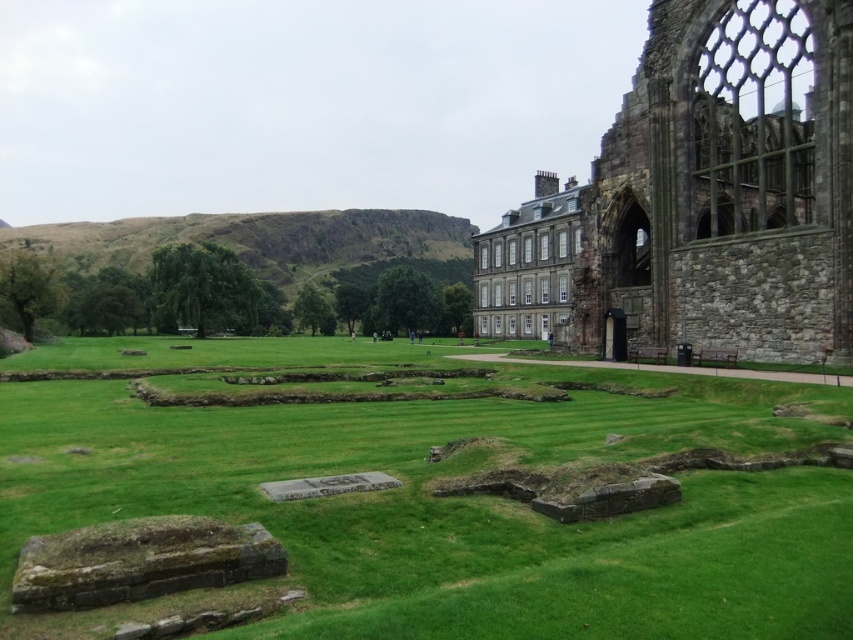
You are a visitor standing at the entrance of the historic stone structure. You notice the green grass at center and the stone wall at right. Which of these two features is positioned lower in the scene?

The green grass at center is located below the stone wall at right, so it is positioned lower in the scene.

You are standing at the entrance of the historic stone structure and want to walk towards the point labeled as point (683, 61). However, there is an obstacle at point (676, 435). Will you encounter this obstacle before reaching your destination?

Yes, you will encounter the obstacle at point (676, 435) before reaching point (683, 61) because point (676, 435) is in front of point (683, 61) according to the coordinates provided.

Based on the photo, you are standing at the entrance of the historic stone structure and want to walk towards the stone wall at right. Which direction should you walk relative to the green grass at center?

You should walk to the right of the green grass at center to reach the stone wall at right since the green grass at center is located to the left of the stone wall at right.